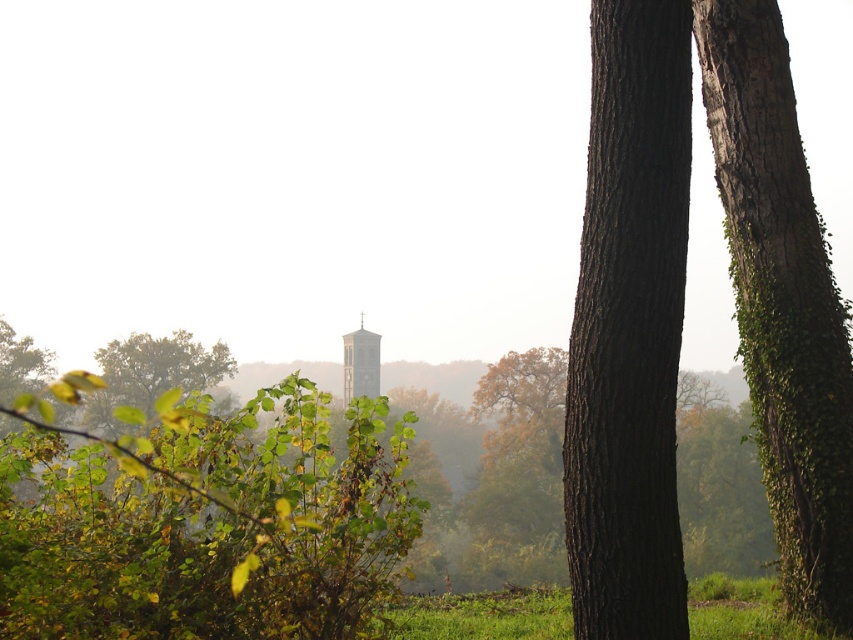
Question: Which point is farther to the camera?

Choices:
 (A) (103, 428)
 (B) (392, 611)
 (C) (355, 369)
 (D) (618, 566)

Answer: (C)

Question: Does dark brown textured tree trunk at right have a greater width compared to smooth gray water tower at center?

Choices:
 (A) no
 (B) yes

Answer: (A)

Question: Which point is farther from the camera taking this photo?

Choices:
 (A) (193, 372)
 (B) (744, 618)
 (C) (780, 307)
 (D) (669, 364)

Answer: (A)

Question: Which object appears closest to the camera in this image?

Choices:
 (A) green leafy tree at left
 (B) green grassy field at lower right
 (C) dark brown textured tree trunk at right
 (D) smooth gray water tower at center

Answer: (C)

Question: Can you confirm if dark brown textured tree trunk at right is thinner than green leafy tree at left?

Choices:
 (A) no
 (B) yes

Answer: (B)

Question: Is green grassy field at lower right above smooth gray water tower at center?

Choices:
 (A) no
 (B) yes

Answer: (B)